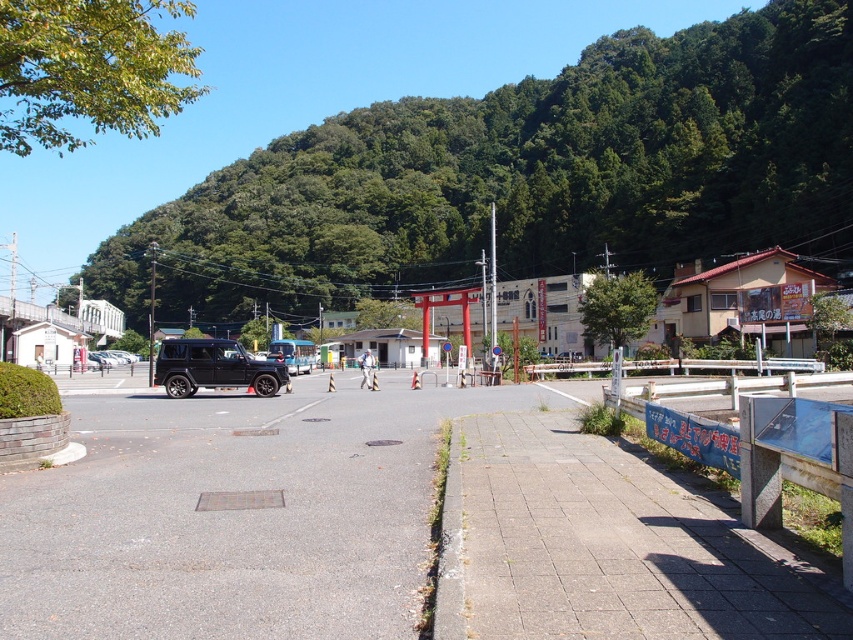
Question: Where is green leafy mountain at upper center located in relation to matte black suv at center-left in the image?

Choices:
 (A) below
 (B) above

Answer: (B)

Question: Does matte black suv at center have a greater width compared to matte black suv at center-left?

Choices:
 (A) yes
 (B) no

Answer: (B)

Question: Which of these objects is positioned farthest from the matte black suv at center?

Choices:
 (A) matte black suv at center-left
 (B) green leafy mountain at upper center

Answer: (B)

Question: Which point is farther to the camera?

Choices:
 (A) (482, 134)
 (B) (102, 349)

Answer: (A)

Question: Which point is farther to the camera?

Choices:
 (A) green leafy mountain at upper center
 (B) matte black suv at center-left

Answer: (A)

Question: Is green leafy mountain at upper center to the right of matte black suv at center from the viewer's perspective?

Choices:
 (A) no
 (B) yes

Answer: (B)